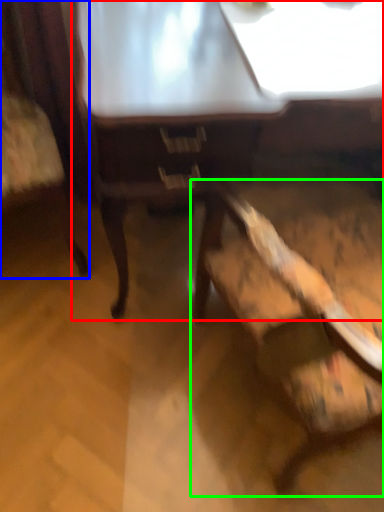
Question: Considering the real-world distances, which object is farthest from table (highlighted by a red box)? chair (highlighted by a blue box) or chair (highlighted by a green box)?

Choices:
 (A) chair
 (B) chair

Answer: (A)